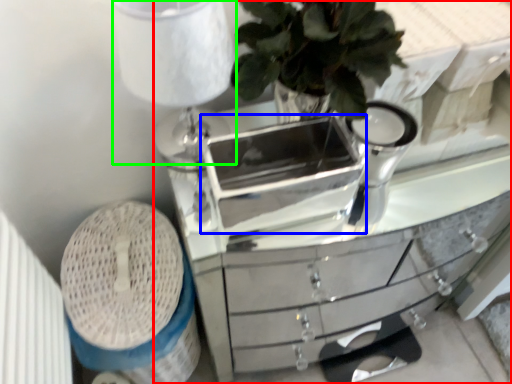
Question: Which object is positioned closest to chest of drawers (highlighted by a red box)? Select from appliance (highlighted by a blue box) and table lamp (highlighted by a green box).

Choices:
 (A) appliance
 (B) table lamp

Answer: (B)